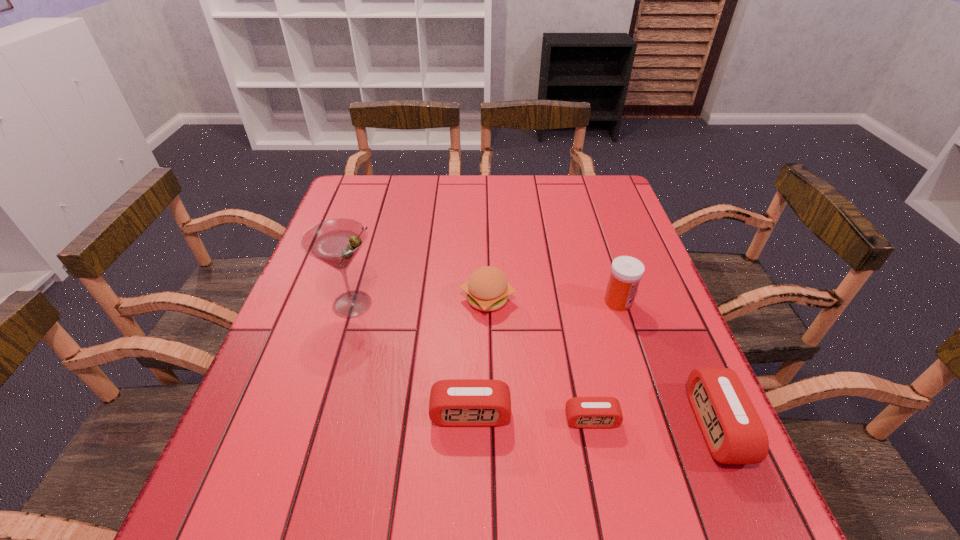
Identify the location of vacant space in between the shortest alarm clock and the rightmost object. This screenshot has width=960, height=540. (654, 423).

This screenshot has width=960, height=540. Identify the location of free space that is in between the second object from right to left and the rightmost alarm clock. (667, 364).

Find the location of a particular element. free space between the second tallest object and the rightmost alarm clock is located at coordinates (667, 364).

Where is `empty space between the shortest alarm clock and the hamburger`? empty space between the shortest alarm clock and the hamburger is located at coordinates point(540,360).

This screenshot has width=960, height=540. What are the coordinates of `free space between the fifth tallest object and the tallest object` in the screenshot? It's located at (412, 359).

Identify the location of free space between the hamburger and the tallest object. (420, 301).

Find the location of a particular element. object that is the third closest to the leftmost alarm clock is located at coordinates [x=335, y=242].

This screenshot has height=540, width=960. I want to click on object that stands as the closest to the second shortest alarm clock, so click(x=582, y=412).

Locate an element on the screen. alarm clock that is the third closest one to the hamburger is located at coordinates (734, 433).

You are a GUI agent. You are given a task and a screenshot of the screen. Output one action in this format:
    pyautogui.click(x=<x>, y=<y>)
    Task: Click on the alarm clock identified as the second closest to the martini
    The width and height of the screenshot is (960, 540).
    Given the screenshot: What is the action you would take?
    pyautogui.click(x=582, y=412)